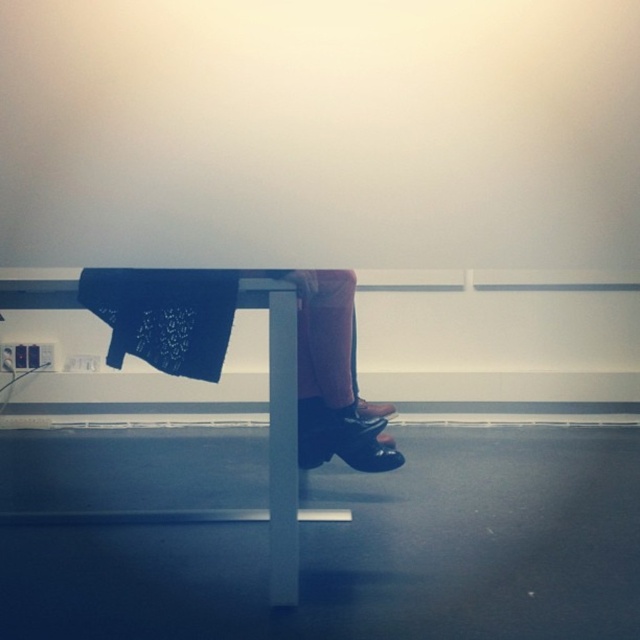
You are a delivery robot with a package that measures 4 inches in length. You need to place the package between the white glossy table at center and the blue textured fabric at center. Is there enough space to fit the package between them?

The distance between the white glossy table at center and the blue textured fabric at center is 3.77 inches, which is slightly less than the package length of 4 inches. Therefore, the package cannot fit between them.

You are a person who wants to place a laptop on the white glossy table at center. However, there is a blue textured fabric at center on top of it. What should you do to access the table?

The white glossy table at center is below the blue textured fabric at center, so you should move the blue textured fabric at center to access the table.